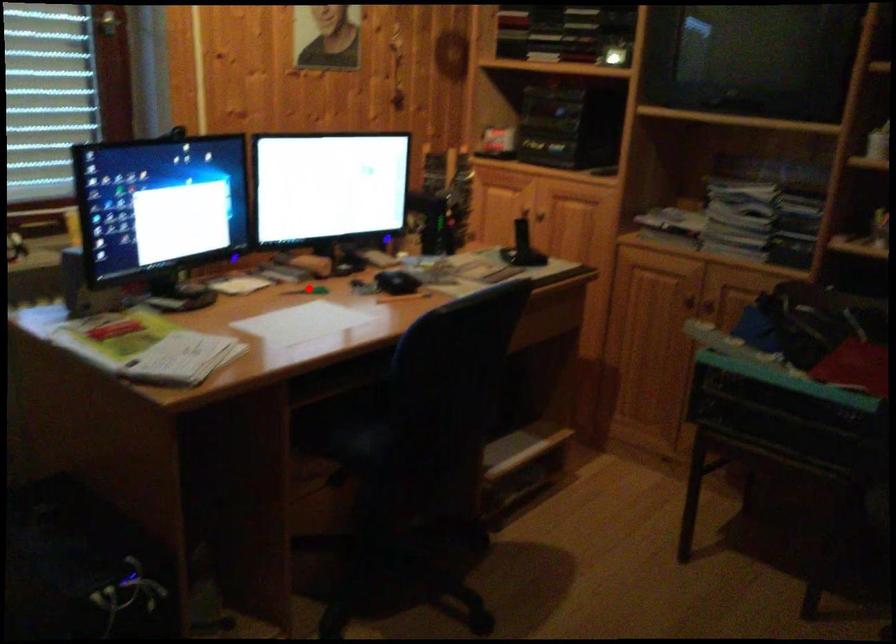
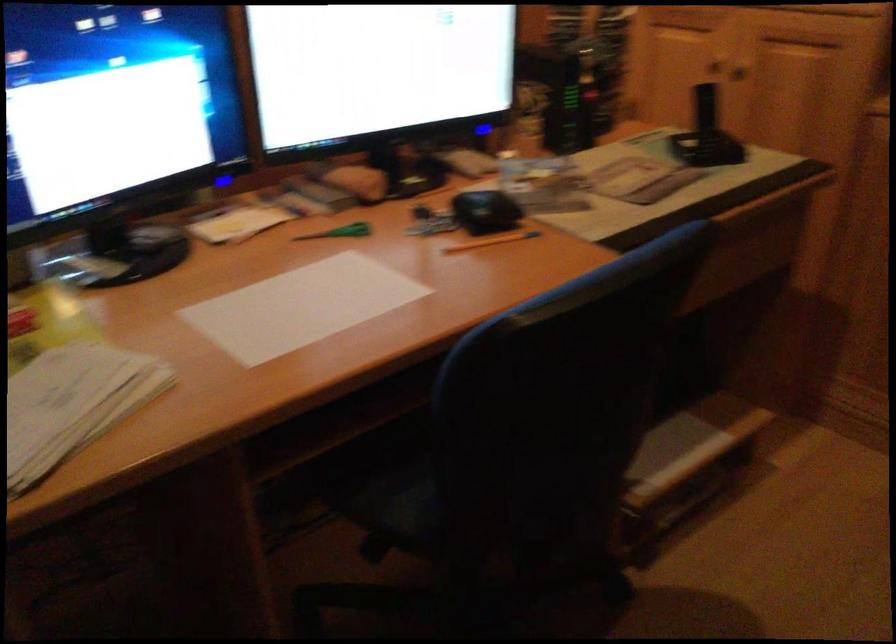
The point at the highlighted location is marked in the first image. Where is the corresponding point in the second image?

(340, 232)